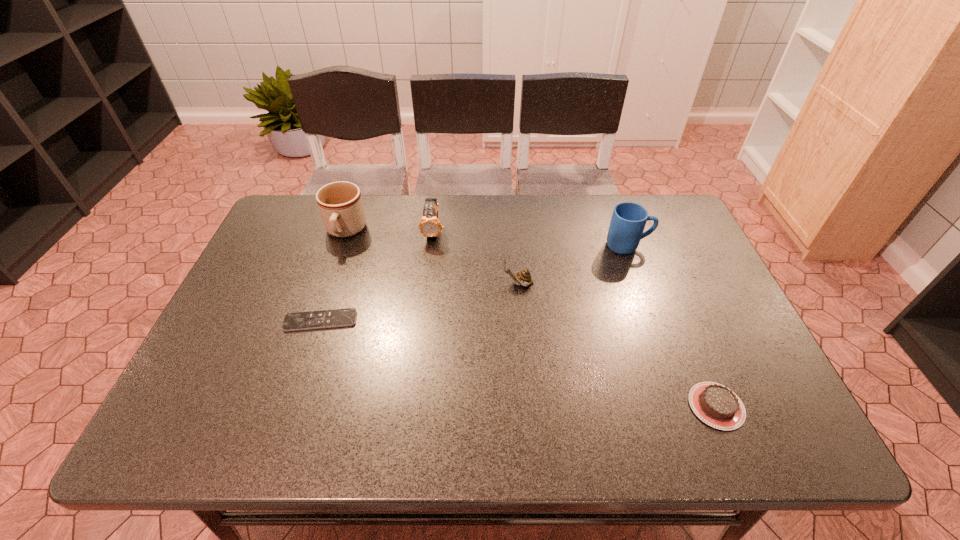
Select which object appears as the third closest to the nearest object. Please provide its 2D coordinates. Your answer should be formatted as a tuple, i.e. [(x, y)], where the tuple contains the x and y coordinates of a point satisfying the conditions above.

[(429, 226)]

Where is `object that ranks as the fifth closest to the shortest object`? object that ranks as the fifth closest to the shortest object is located at coordinates (716, 405).

The image size is (960, 540). I want to click on free spot that satisfies the following two spatial constraints: 1. on the side of the left mug with the handle; 2. on the right side of the nearest object, so click(286, 406).

Identify the location of vacant region that satisfies the following two spatial constraints: 1. on the face of the third nearest object; 2. on the right side of the chocolate cake. (528, 406).

Where is `vacant space that satisfies the following two spatial constraints: 1. on the side of the fifth tallest object with the handle; 2. on the left side of the right mug`? vacant space that satisfies the following two spatial constraints: 1. on the side of the fifth tallest object with the handle; 2. on the left side of the right mug is located at coordinates (685, 406).

This screenshot has width=960, height=540. Identify the location of free space that satisfies the following two spatial constraints: 1. on the face of the watch; 2. on the right side of the nearest object. (413, 406).